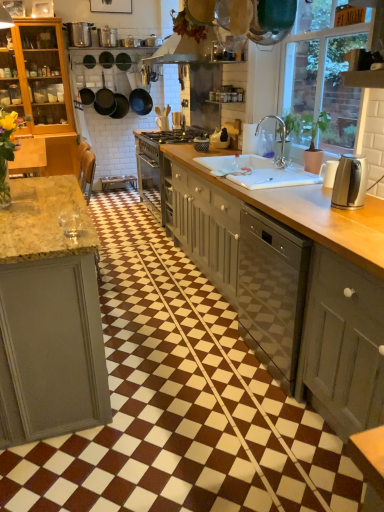
The width and height of the screenshot is (384, 512). I want to click on free region on the left part of matte black basket at center, the second appliance positioned from the bottom, so click(190, 145).